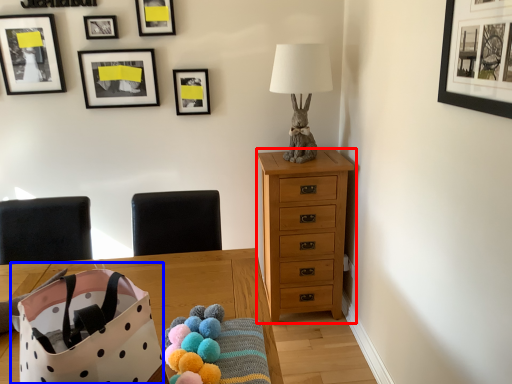
Question: Which object appears farthest to the camera in this image, chest of drawers (highlighted by a red box) or gift bag (highlighted by a blue box)?

Choices:
 (A) chest of drawers
 (B) gift bag

Answer: (A)